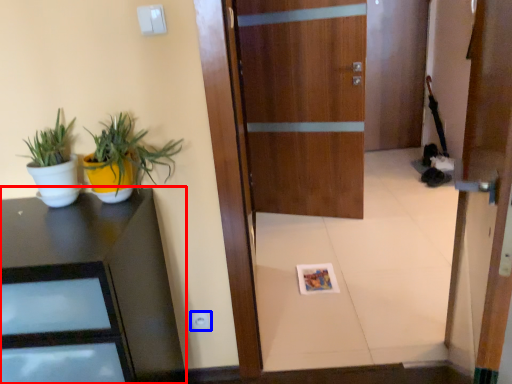
Question: Which object appears farthest to the camera in this image, desk (highlighted by a red box) or electric outlet (highlighted by a blue box)?

Choices:
 (A) desk
 (B) electric outlet

Answer: (B)